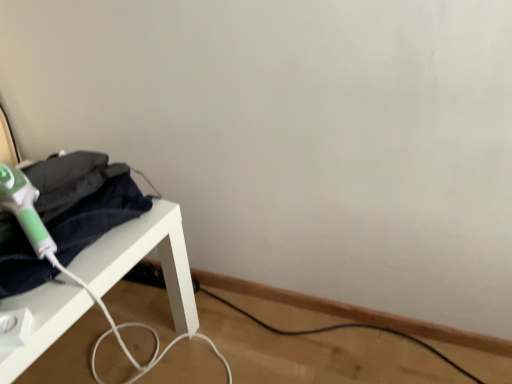
Question: Should I look upward or downward to see white plastic table at left?

Choices:
 (A) up
 (B) down

Answer: (B)

Question: Is green plastic hair dryer at left taller than white plastic table at left?

Choices:
 (A) no
 (B) yes

Answer: (A)

Question: Is white plastic table at left at the back of green plastic hair dryer at left?

Choices:
 (A) yes
 (B) no

Answer: (B)

Question: Does green plastic hair dryer at left have a larger size compared to white plastic table at left?

Choices:
 (A) yes
 (B) no

Answer: (B)

Question: Does green plastic hair dryer at left appear on the left side of white plastic table at left?

Choices:
 (A) no
 (B) yes

Answer: (A)

Question: Is green plastic hair dryer at left not close to white plastic table at left?

Choices:
 (A) no
 (B) yes

Answer: (A)

Question: From the image's perspective, would you say green plastic hair dryer at left is shown under white plastic table at left?

Choices:
 (A) yes
 (B) no

Answer: (B)

Question: Is white plastic table at left to the left of green plastic hair dryer at left from the viewer's perspective?

Choices:
 (A) no
 (B) yes

Answer: (B)

Question: Is white plastic table at left to the right of green plastic hair dryer at left from the viewer's perspective?

Choices:
 (A) yes
 (B) no

Answer: (B)

Question: From the image's perspective, would you say white plastic table at left is positioned over green plastic hair dryer at left?

Choices:
 (A) no
 (B) yes

Answer: (A)

Question: From a real-world perspective, does white plastic table at left stand above green plastic hair dryer at left?

Choices:
 (A) yes
 (B) no

Answer: (B)

Question: Is white plastic table at left wider than green plastic hair dryer at left?

Choices:
 (A) yes
 (B) no

Answer: (A)

Question: Is white plastic table at left outside of green plastic hair dryer at left?

Choices:
 (A) yes
 (B) no

Answer: (A)

Question: Is white plastic table at left spatially inside green plastic hair dryer at left, or outside of it?

Choices:
 (A) inside
 (B) outside

Answer: (B)